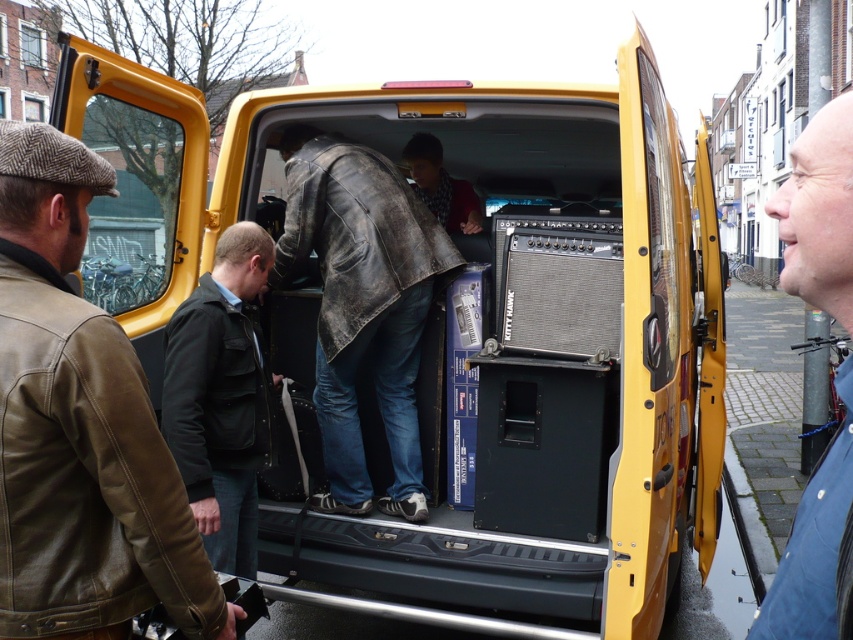
Question: From the image, what is the correct spatial relationship of leather jacket at center in relation to blue denim jacket at lower right?

Choices:
 (A) below
 (B) above

Answer: (A)

Question: Which object appears farthest from the camera in this image?

Choices:
 (A) blue denim jacket at lower right
 (B) leather jacket at center
 (C) brown leather jacket at left
 (D) black leather jacket at center

Answer: (B)

Question: Can you confirm if brown leather jacket at left is positioned to the left of blue denim jacket at lower right?

Choices:
 (A) no
 (B) yes

Answer: (B)

Question: Estimate the real-world distances between objects in this image. Which object is closer to the blue denim jacket at lower right?

Choices:
 (A) brown leather jacket at left
 (B) black leather jacket at center

Answer: (A)

Question: Which object is farther from the camera taking this photo?

Choices:
 (A) blue denim jacket at lower right
 (B) brown leather jacket at left

Answer: (B)

Question: Can you confirm if black leather jacket at center is positioned above blue denim jacket at lower right?

Choices:
 (A) yes
 (B) no

Answer: (B)